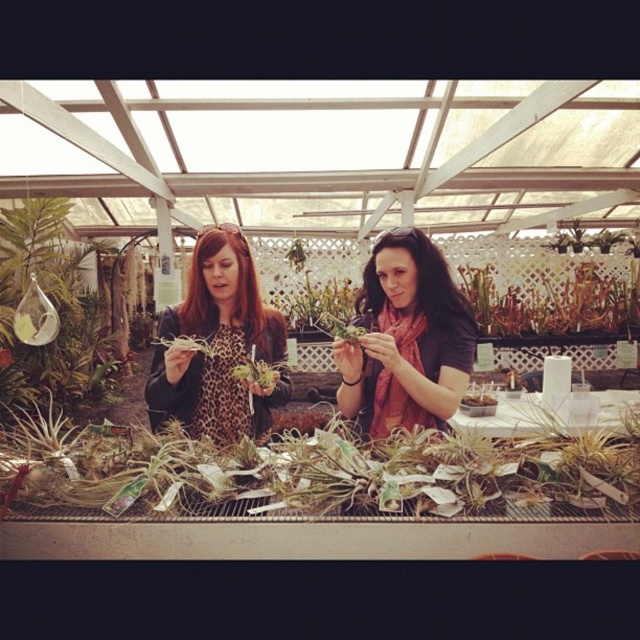
Between matte black scarf at center and leopard print jacket at center, which one is positioned higher?

leopard print jacket at center is higher up.

Is matte black scarf at center in front of leopard print jacket at center?

That is True.

Does point (378, 282) come behind point (179, 410)?

That is True.

Where is `matte black scarf at center`? The height and width of the screenshot is (640, 640). matte black scarf at center is located at coordinates (404, 339).

Can you confirm if green leafy plant at center is positioned below green matte plant at center?

Yes.

Which is above, green leafy plant at center or green matte plant at center?

green matte plant at center

Does point (90, 429) come farther from viewer compared to point (292, 312)?

No.

At what (x,y) coordinates should I click in order to perform the action: click on green leafy plant at center. Please return your answer as a coordinate pair (x, y). Looking at the image, I should click on (321, 472).

Between green leafy plant at center and matte black scarf at center, which one is positioned lower?

green leafy plant at center is below.

Can you confirm if green leafy plant at center is thinner than matte black scarf at center?

In fact, green leafy plant at center might be wider than matte black scarf at center.

At what (x,y) coordinates should I click in order to perform the action: click on green leafy plant at center. Please return your answer as a coordinate pair (x, y). Image resolution: width=640 pixels, height=640 pixels. Looking at the image, I should click on (321, 472).